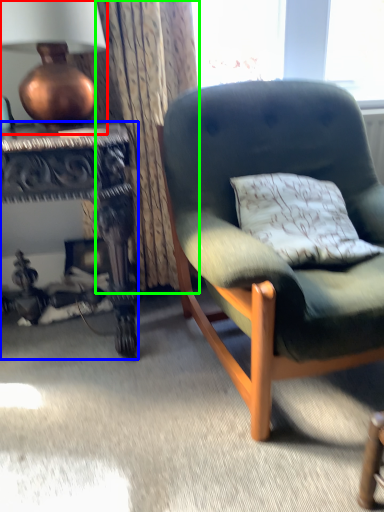
Question: Which is nearer to the lamp (highlighted by a red box)? desk (highlighted by a blue box) or curtain (highlighted by a green box).

Choices:
 (A) desk
 (B) curtain

Answer: (B)